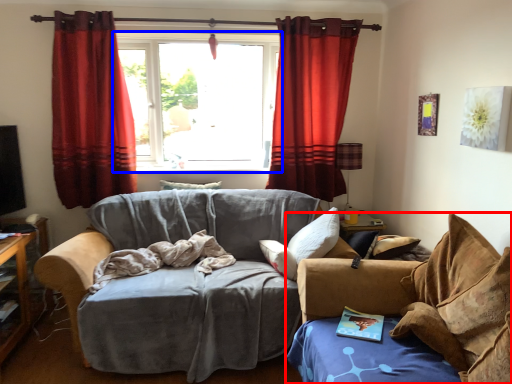
Question: Among these objects, which one is nearest to the camera, studio couch (highlighted by a red box) or window (highlighted by a blue box)?

Choices:
 (A) studio couch
 (B) window

Answer: (A)